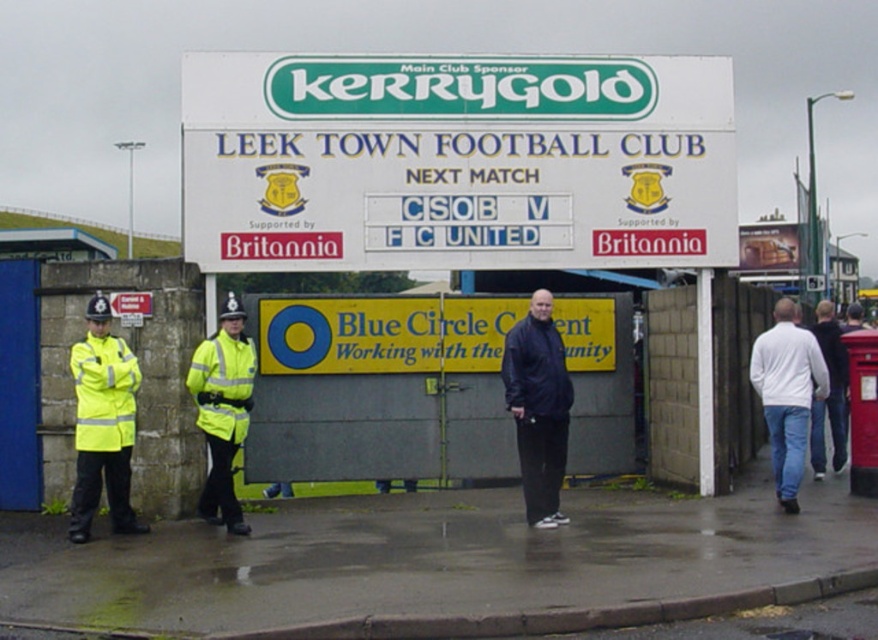
Question: Does green plastic sign at upper center appear under dark blue jacket at center?

Choices:
 (A) no
 (B) yes

Answer: (A)

Question: Based on their relative distances, which object is farther from the high-visibility fabric safety vest at left?

Choices:
 (A) white matte shirt at center
 (B) dark blue jacket at center
 (C) yellow reflective safety vest at left

Answer: (A)

Question: Which of the following is the closest to the observer?

Choices:
 (A) (534, 348)
 (B) (569, 120)
 (C) (231, 465)

Answer: (A)

Question: Is green plastic sign at upper center positioned before white matte shirt at center?

Choices:
 (A) yes
 (B) no

Answer: (B)

Question: Which object is the farthest from the dark blue jacket at center?

Choices:
 (A) black matte jacket at center
 (B) yellow reflective safety vest at left
 (C) high-visibility fabric safety vest at left

Answer: (C)

Question: Can you confirm if high-visibility fabric safety vest at left is bigger than white matte shirt at center?

Choices:
 (A) no
 (B) yes

Answer: (A)